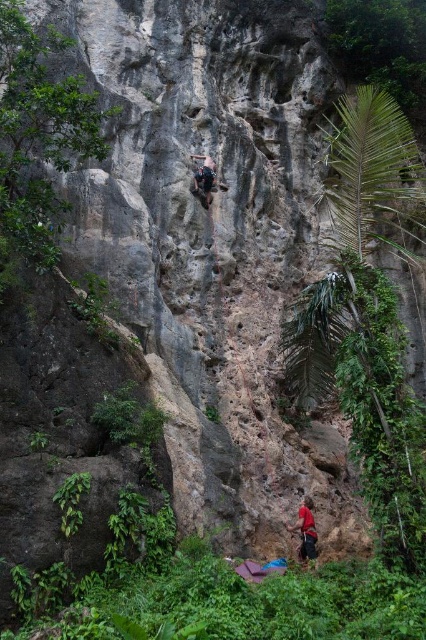
Is red fabric pants at lower center in front of matte black climbing harness at center?

Yes.

Locate an element on the screen. red fabric pants at lower center is located at coordinates (305, 529).

Identify the location of red fabric pants at lower center. (305, 529).